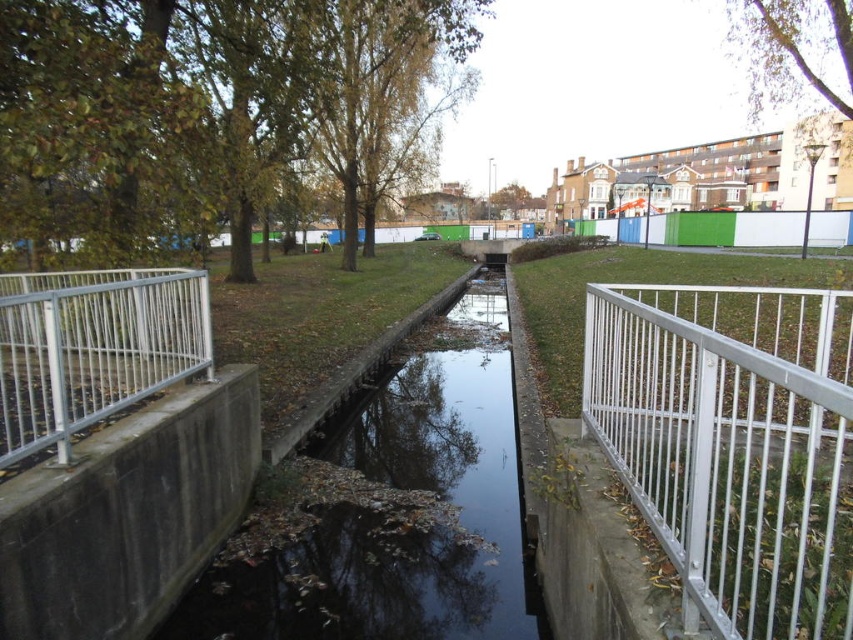
You are a maintenance worker needing to inspect both the silver metallic fence at left and the green fabric fence at center. Given that your equipment can only cover a 40 meter distance before needing a recharge, can you inspect both fences without needing to recharge?

The silver metallic fence at left and the green fabric fence at center are 39.34 meters apart. Since your equipment can cover up to 40 meters, you can inspect both fences without needing to recharge as the distance between them is within the 40 meter limit.

You are a maintenance worker needing to access the silver metallic fence at left for repairs. The black concrete stream at center is in your way. Can you walk around it on the grassy areas? Explain why based on the scene description.

The silver metallic fence at left is behind the black concrete stream at center, so you can walk around the black concrete stream at center on the grassy areas on either side to reach the silver metallic fence at left.

You are standing at the entrance of the park and want to locate the black concrete stream at center. According to the map coordinates, where would you find it?

The black concrete stream at center is located at coordinates point (405, 532).